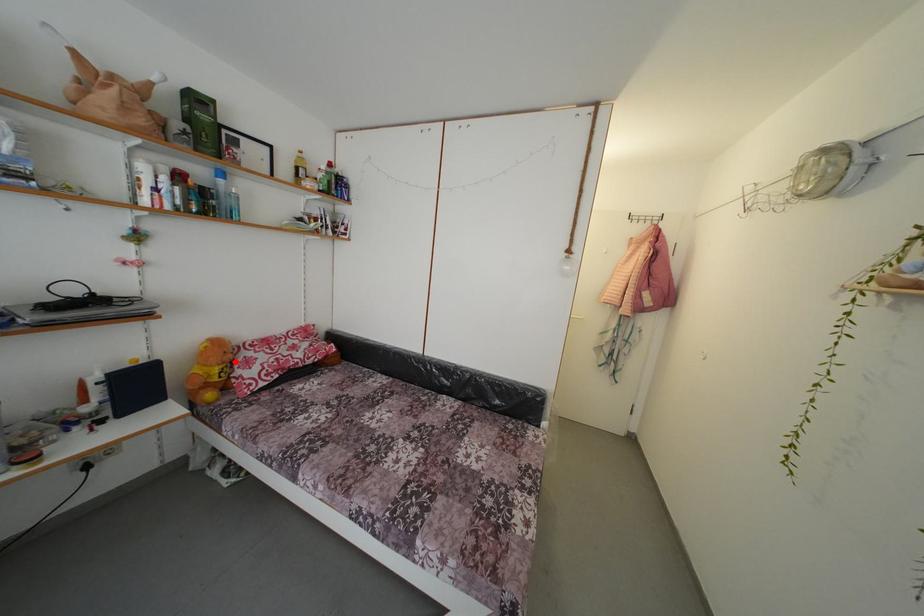
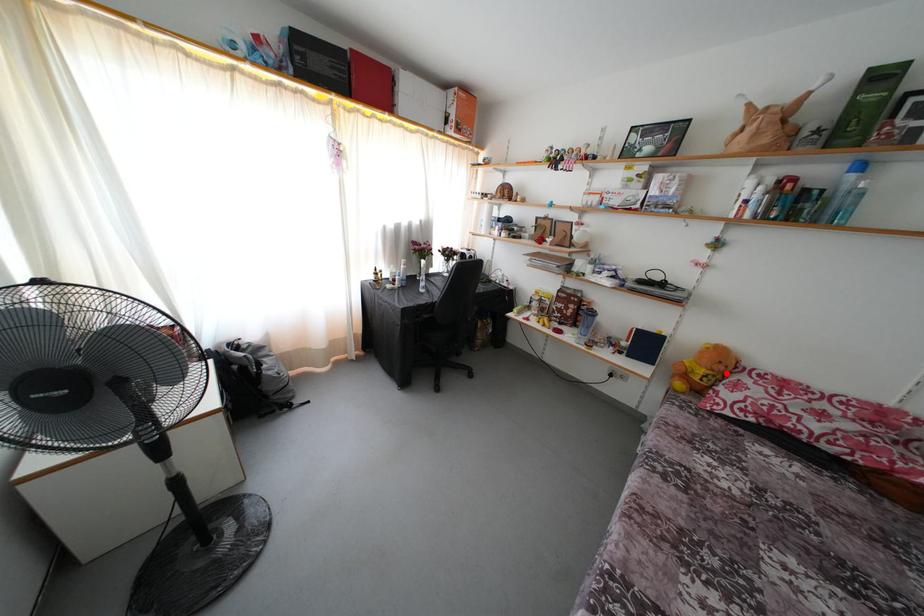
I am providing you with two images of the same scene from different viewpoints. A red point is marked on the first image and another point is marked on the second image. Is the red point in image1 aligned with the point shown in image2?

Yes